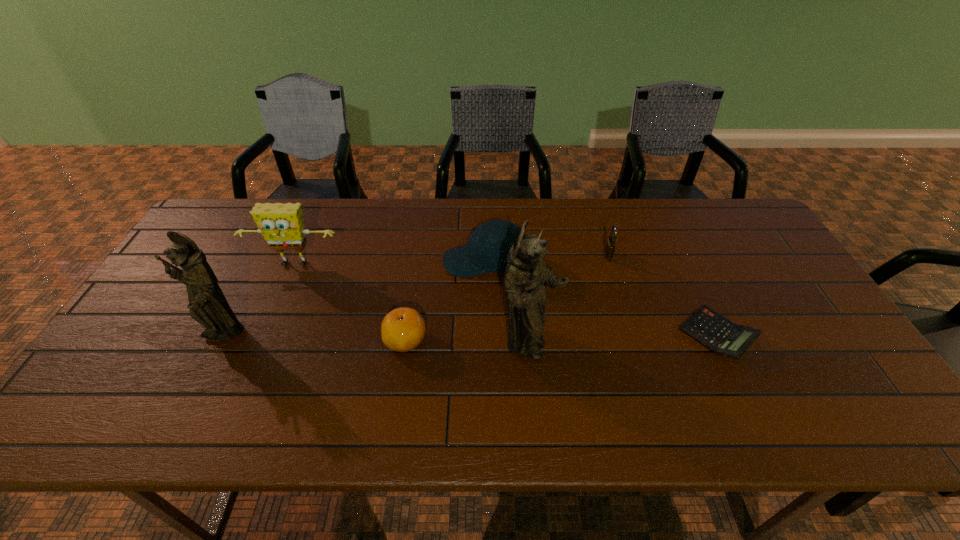
Identify the location of free spot located 0.110m on the back of the second shortest object. (413, 293).

You are a GUI agent. You are given a task and a screenshot of the screen. Output one action in this format:
    pyautogui.click(x=<x>, y=<y>)
    Task: Click on the figurine situated at the near edge
    Image resolution: width=960 pixels, height=540 pixels.
    Given the screenshot: What is the action you would take?
    pyautogui.click(x=526, y=276)

This screenshot has width=960, height=540. I want to click on calculator that is positioned at the near edge, so click(x=712, y=330).

Identify the location of vacant region at the far edge of the desktop. (529, 225).

In the image, there is a desktop. What are the coordinates of `vacant space at the near edge` in the screenshot? It's located at (422, 376).

Locate an element on the screen. The width and height of the screenshot is (960, 540). free space at the right edge of the desktop is located at coordinates (821, 319).

In the image, there is a desktop. Where is `vacant space at the far left corner`? The width and height of the screenshot is (960, 540). vacant space at the far left corner is located at coordinates (223, 211).

Locate an element on the screen. free space at the near left corner of the desktop is located at coordinates (154, 390).

Locate an element on the screen. The image size is (960, 540). vacant area at the far right corner of the desktop is located at coordinates (750, 231).

This screenshot has height=540, width=960. In the image, there is a desktop. Find the location of `free space at the near right corner`. free space at the near right corner is located at coordinates (821, 385).